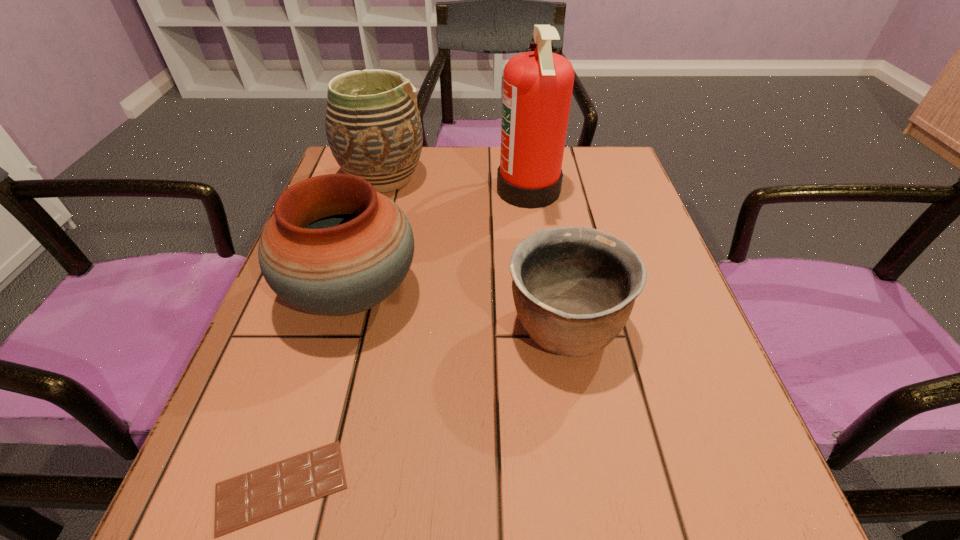
The width and height of the screenshot is (960, 540). What are the coordinates of `free space that is in between the farthest pottery and the fire extinguisher` in the screenshot? It's located at (456, 184).

The height and width of the screenshot is (540, 960). Identify the location of free space between the second shortest pottery and the shortest object. (317, 389).

Identify the location of vacant point located between the shortest object and the rightmost pottery. The height and width of the screenshot is (540, 960). (422, 407).

The image size is (960, 540). In order to click on object that is the nearest to the fire extinguisher in this screenshot , I will do `click(334, 246)`.

Find the location of a particular element. The height and width of the screenshot is (540, 960). object that is the fourth closest to the farthest pottery is located at coordinates (243, 500).

The image size is (960, 540). Identify the location of pottery that is the closest one to the farthest pottery. (334, 246).

Point out which pottery is positioned as the nearest to the tallest object. Please provide its 2D coordinates. Your answer should be formatted as a tuple, i.e. [(x, y)], where the tuple contains the x and y coordinates of a point satisfying the conditions above.

[(334, 246)]

Image resolution: width=960 pixels, height=540 pixels. Identify the location of free space that satisfies the following two spatial constraints: 1. at the nozzle of the tallest object; 2. on the left side of the second shortest object. (547, 328).

This screenshot has width=960, height=540. What are the coordinates of `vacant region that satisfies the following two spatial constraints: 1. on the front side of the fourth tallest object; 2. on the left side of the farthest pottery` in the screenshot? It's located at (341, 328).

You are a GUI agent. You are given a task and a screenshot of the screen. Output one action in this format:
    pyautogui.click(x=<x>, y=<y>)
    Task: Click on the free point that satisfies the following two spatial constraints: 1. on the back side of the rightmost pottery; 2. at the nozzle of the tallest object
    
    Given the screenshot: What is the action you would take?
    pyautogui.click(x=540, y=190)